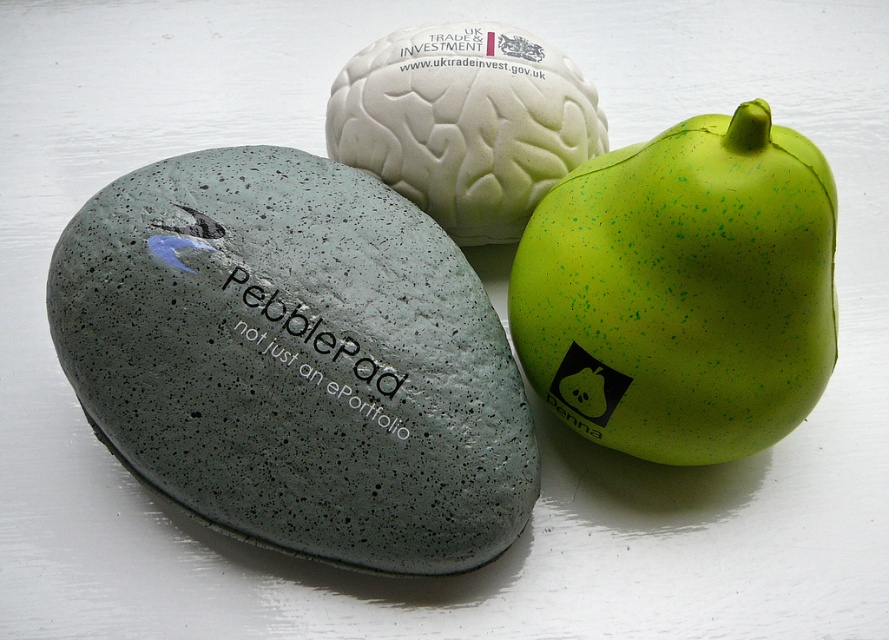
Between point (459, 266) and point (495, 97), which one is positioned behind?

Point (495, 97)

Is speckled gray stone at center-left smaller than white matte brain at center?

Incorrect, speckled gray stone at center-left is not smaller in size than white matte brain at center.

Image resolution: width=889 pixels, height=640 pixels. What are the coordinates of `speckled gray stone at center-left` in the screenshot? It's located at (295, 358).

Locate an element on the screen. Image resolution: width=889 pixels, height=640 pixels. speckled gray stone at center-left is located at coordinates (295, 358).

Describe the element at coordinates (295, 358) in the screenshot. I see `speckled gray stone at center-left` at that location.

Describe the element at coordinates (295, 358) in the screenshot. I see `speckled gray stone at center-left` at that location.

Identify the location of speckled gray stone at center-left. (295, 358).

Does green speckled rubber at center right have a larger size compared to white matte brain at center?

Yes.

Does green speckled rubber at center right appear on the right side of white matte brain at center?

Correct, you'll find green speckled rubber at center right to the right of white matte brain at center.

Which is in front, point (650, 211) or point (535, 86)?

Point (650, 211) is more forward.

Find the location of a particular element. The width and height of the screenshot is (889, 640). green speckled rubber at center right is located at coordinates (683, 291).